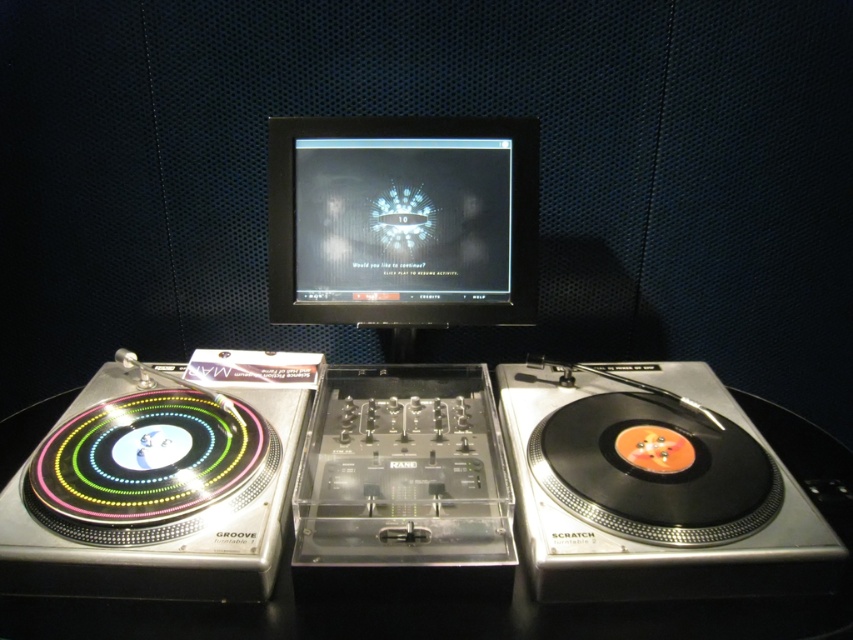
Question: Is black vinyl record at right thinner than black glossy monitor at center?

Choices:
 (A) yes
 (B) no

Answer: (A)

Question: Is black vinyl record at right wider than black glossy monitor at center?

Choices:
 (A) no
 (B) yes

Answer: (A)

Question: Which of the following is the closest to the observer?

Choices:
 (A) black vinyl record at right
 (B) black glossy monitor at center

Answer: (A)

Question: Among these points, which one is nearest to the camera?

Choices:
 (A) (456, 282)
 (B) (534, 378)

Answer: (A)

Question: Does black vinyl record at right appear over black glossy monitor at center?

Choices:
 (A) yes
 (B) no

Answer: (B)